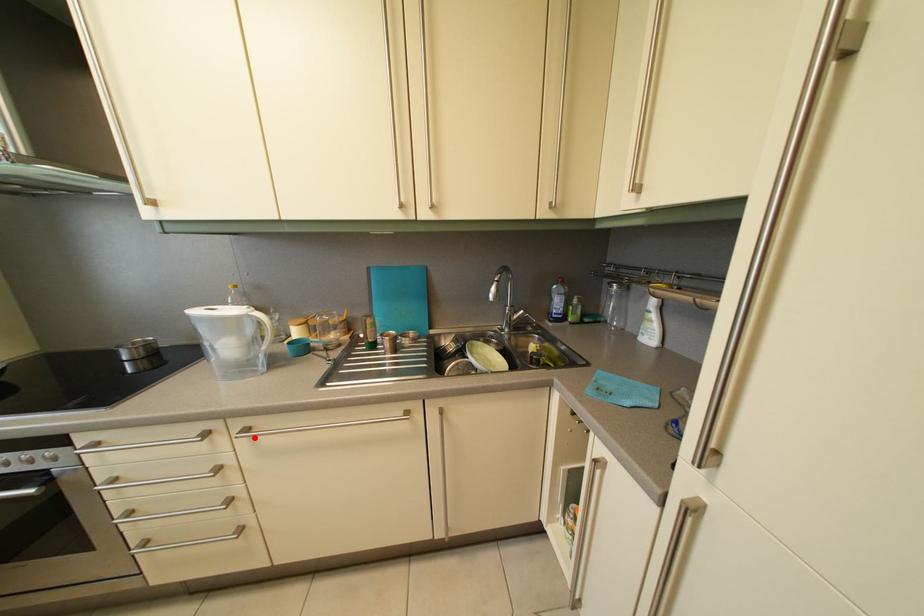
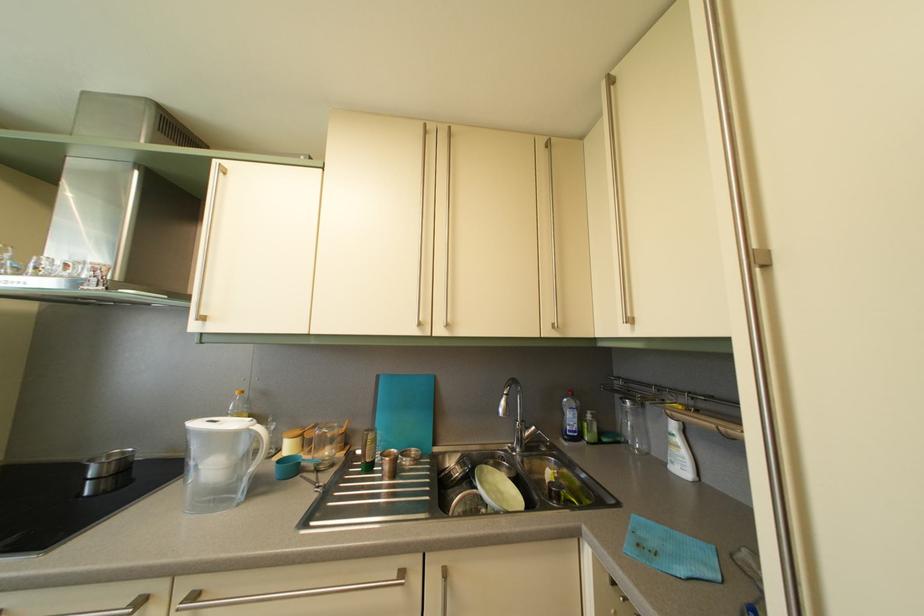
Question: I am providing you with two images of the same scene from different viewpoints. Image1 has a red point marked. In image2, the corresponding 3D location appears at what relative position? Reply with the corresponding letter.

Choices:
 (A) Closer
 (B) Farther

Answer: (A)